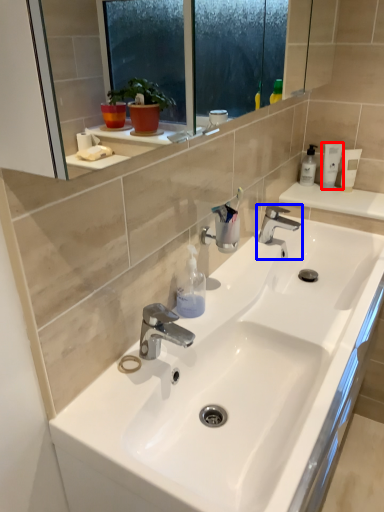
Question: Which of the following is the farthest to the observer, toiletry (highlighted by a red box) or tap (highlighted by a blue box)?

Choices:
 (A) toiletry
 (B) tap

Answer: (A)